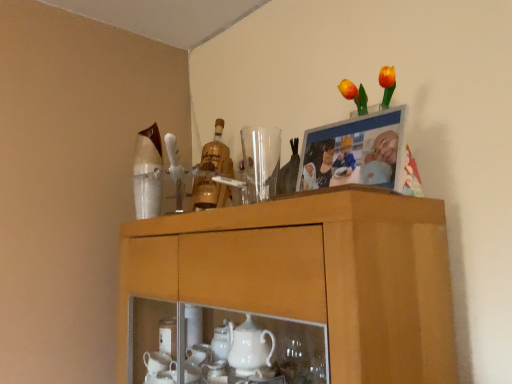
Question: Is wooden cabinet at upper center positioned far away from gold glass bottle at center?

Choices:
 (A) yes
 (B) no

Answer: (B)

Question: Considering the relative sizes of wooden cabinet at upper center and gold glass bottle at center in the image provided, is wooden cabinet at upper center wider than gold glass bottle at center?

Choices:
 (A) yes
 (B) no

Answer: (A)

Question: Considering the relative sizes of wooden cabinet at upper center and gold glass bottle at center in the image provided, is wooden cabinet at upper center taller than gold glass bottle at center?

Choices:
 (A) yes
 (B) no

Answer: (A)

Question: Can you confirm if wooden cabinet at upper center is shorter than gold glass bottle at center?

Choices:
 (A) no
 (B) yes

Answer: (A)

Question: From the image's perspective, would you say wooden cabinet at upper center is shown under gold glass bottle at center?

Choices:
 (A) yes
 (B) no

Answer: (A)

Question: Is wooden cabinet at upper center aimed at gold glass bottle at center?

Choices:
 (A) yes
 (B) no

Answer: (B)

Question: Is gold glass bottle at center closer to camera compared to transparent glass at upper center?

Choices:
 (A) yes
 (B) no

Answer: (B)

Question: Is gold glass bottle at center shorter than transparent glass at upper center?

Choices:
 (A) yes
 (B) no

Answer: (B)

Question: From a real-world perspective, does gold glass bottle at center sit lower than transparent glass at upper center?

Choices:
 (A) yes
 (B) no

Answer: (B)

Question: Is the position of gold glass bottle at center more distant than that of transparent glass at upper center?

Choices:
 (A) no
 (B) yes

Answer: (B)

Question: From a real-world perspective, is gold glass bottle at center positioned over transparent glass at upper center based on gravity?

Choices:
 (A) yes
 (B) no

Answer: (A)

Question: From the image's perspective, is gold glass bottle at center beneath transparent glass at upper center?

Choices:
 (A) yes
 (B) no

Answer: (B)

Question: Is wooden cabinet at upper center completely or partially inside transparent glass at upper center?

Choices:
 (A) no
 (B) yes

Answer: (A)